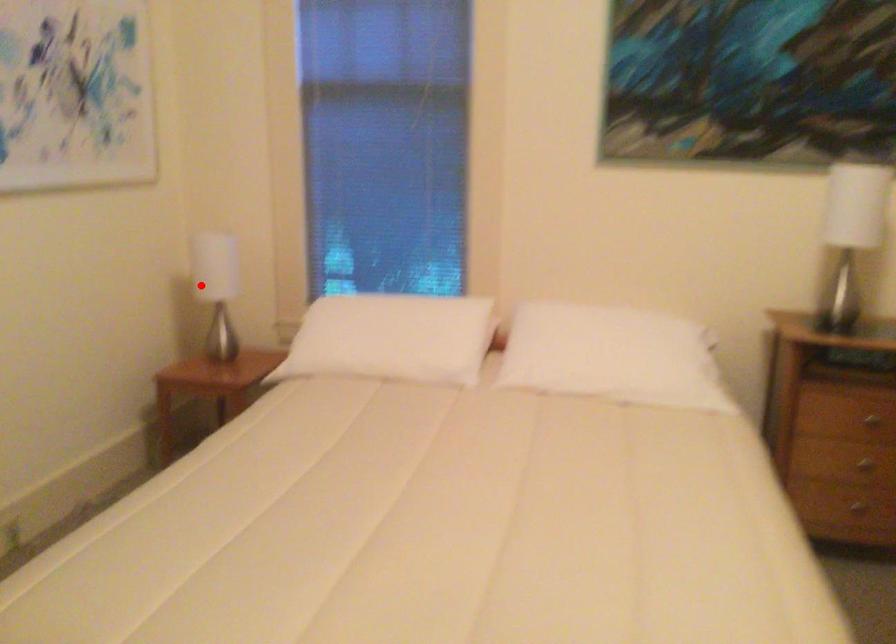
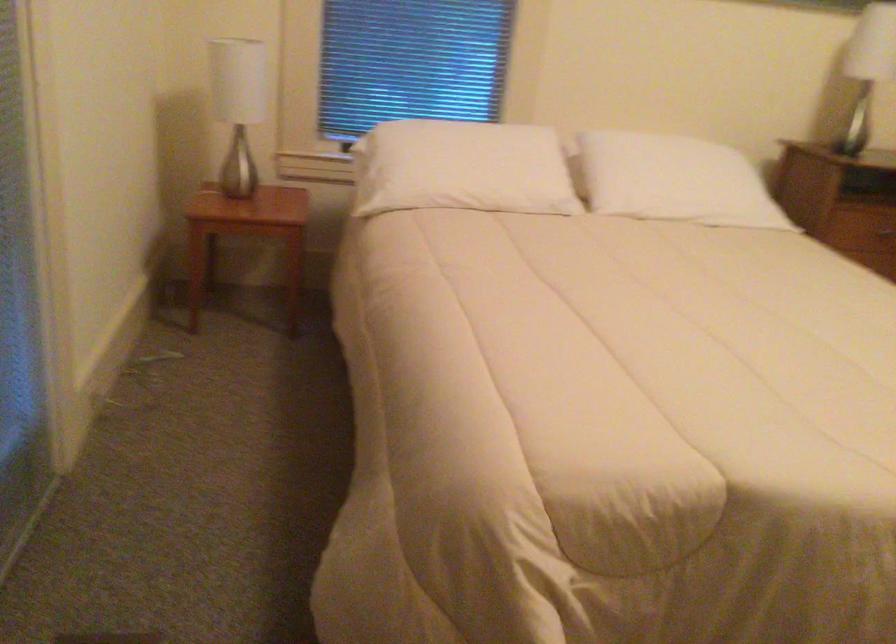
Question: I am providing you with two images of the same scene from different viewpoints. In image1, a red point is highlighted. Considering the same 3D point in image2, which of the following is correct?

Choices:
 (A) It is closer
 (B) It is farther

Answer: (A)